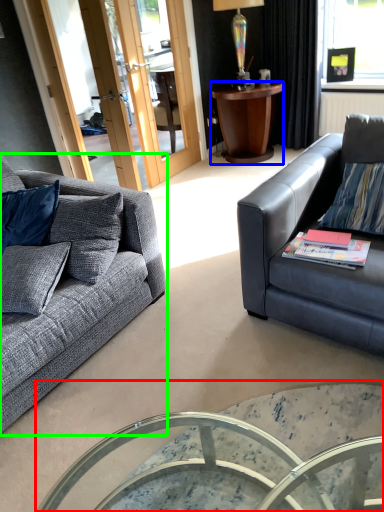
Question: Which object is positioned closest to coffee table (highlighted by a red box)? Select from desk (highlighted by a blue box) and studio couch (highlighted by a green box).

Choices:
 (A) desk
 (B) studio couch

Answer: (B)